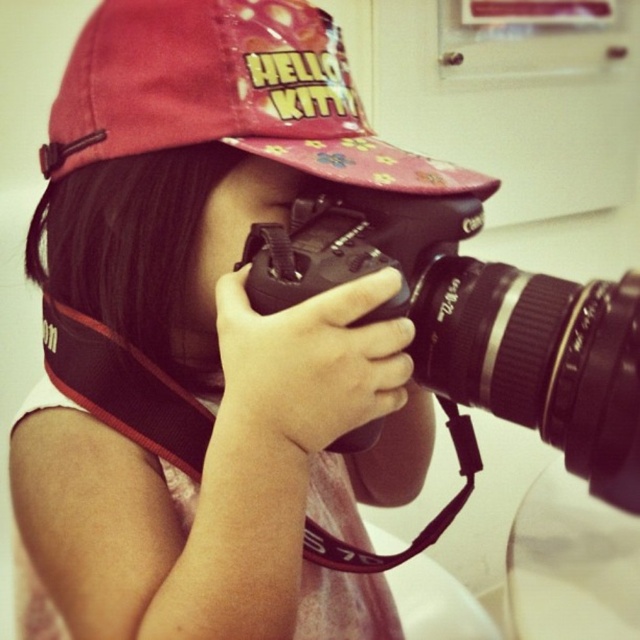
Question: Is black plastic camera at center behind pink fabric cap at upper center?

Choices:
 (A) no
 (B) yes

Answer: (A)

Question: Among these points, which one is nearest to the camera?

Choices:
 (A) pyautogui.click(x=625, y=413)
 (B) pyautogui.click(x=248, y=80)

Answer: (A)

Question: Which point is farther to the camera?

Choices:
 (A) (316, 292)
 (B) (76, 157)

Answer: (B)

Question: Does black plastic camera at center lie behind pink fabric cap at upper center?

Choices:
 (A) yes
 (B) no

Answer: (B)

Question: Can you confirm if black plastic camera at center is positioned below pink fabric cap at upper center?

Choices:
 (A) yes
 (B) no

Answer: (A)